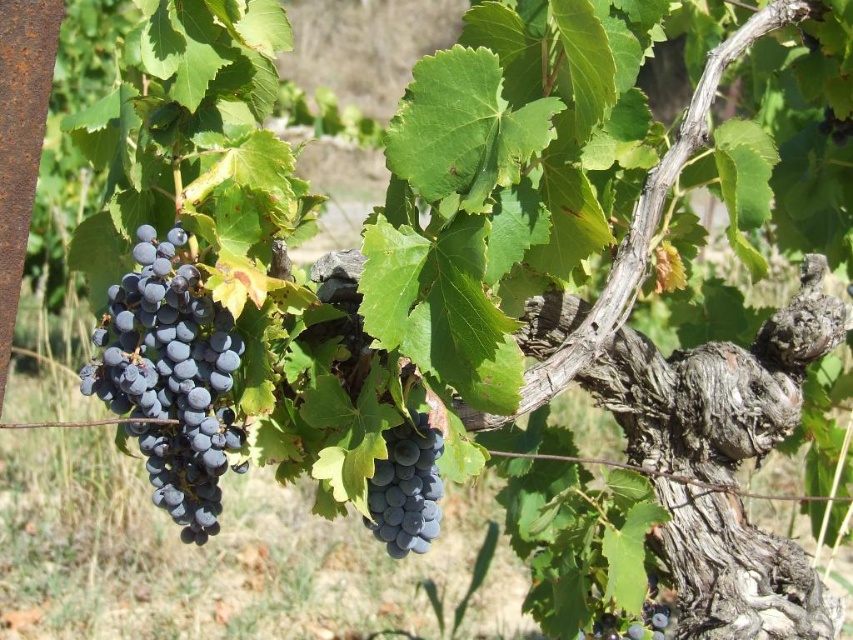
Question: Is dark purple grapes at left positioned in front of dark purple grapes at lower right?

Choices:
 (A) no
 (B) yes

Answer: (B)

Question: Does dark purple grapes at left appear on the left side of shiny dark blue grapes at center?

Choices:
 (A) yes
 (B) no

Answer: (A)

Question: Which point is closer to the camera?

Choices:
 (A) dark purple grapes at lower right
 (B) shiny dark blue grapes at center

Answer: (B)

Question: In this image, where is shiny dark blue grapes at center located relative to dark purple grapes at lower right?

Choices:
 (A) below
 (B) above

Answer: (B)

Question: Which point is closer to the camera?

Choices:
 (A) shiny dark blue grapes at center
 (B) dark purple grapes at left

Answer: (B)

Question: Which point is closer to the camera taking this photo?

Choices:
 (A) (190, 316)
 (B) (405, 500)

Answer: (A)